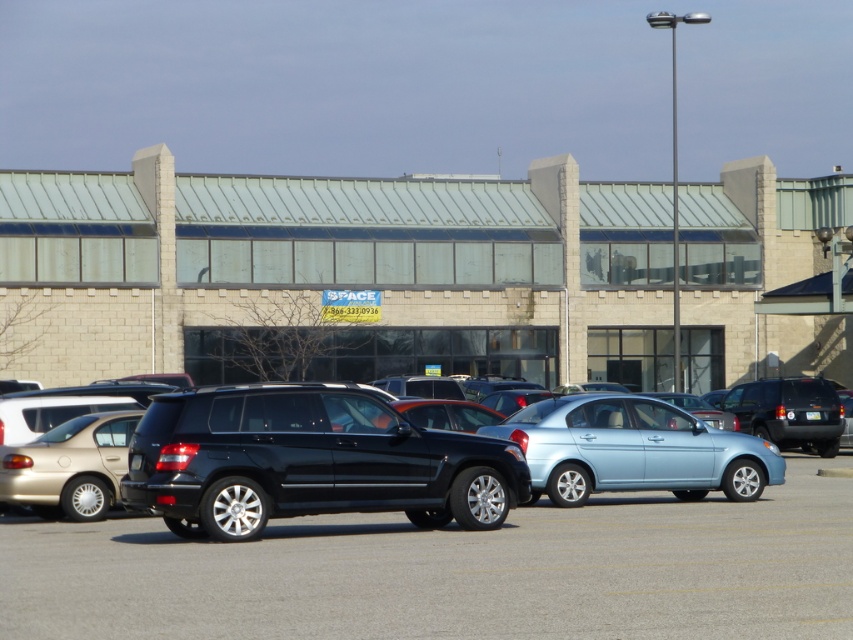
You are a delivery person trying to park your van between the shiny black SUV at center and the glossy black SUV at center. The van requires a minimum height clearance of 2 meters. Can you determine if there is enough vertical space between these two SUVs to safely park your van?

The shiny black SUV at center is taller than the glossy black SUV at center. Since the van requires a minimum height clearance of 2 meters, but the exact height difference between the SUVs isn t provided, it s uncertain if there s sufficient space. You should measure the gap before proceeding.

You are a delivery driver who needs to park your truck in the parking lot. You see the shiny black suv at center and the light blue metallic sedan at center. Which vehicle should you avoid parking next to if you need more space for your truck?

You should avoid parking next to the shiny black suv at center because it is wider than the light blue metallic sedan at center, requiring more space.